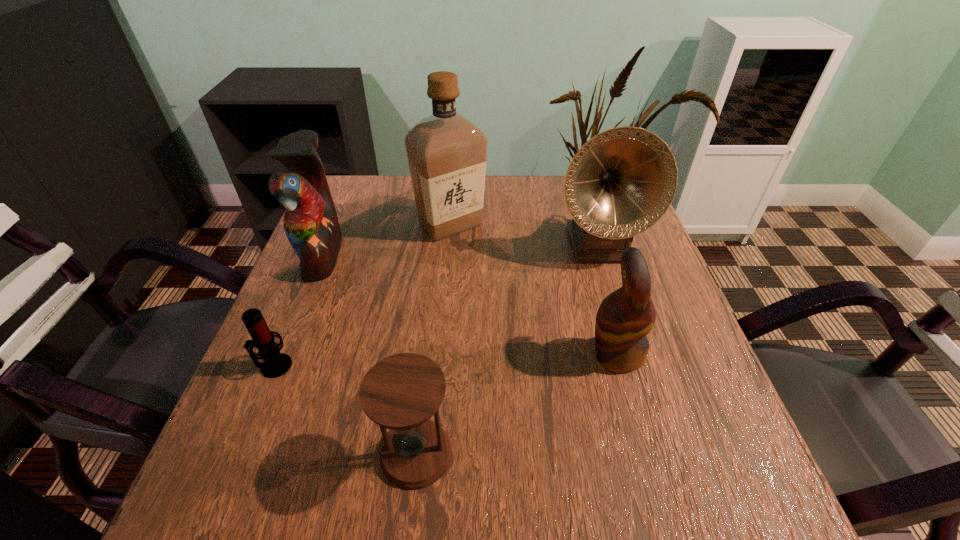
Identify the location of phonograph record located in the right edge section of the desktop. This screenshot has width=960, height=540. (622, 181).

Find the location of a particular element. parrot situated at the right edge is located at coordinates (624, 318).

At what (x,y) coordinates should I click in order to perform the action: click on object located at the far right corner. Please return your answer as a coordinate pair (x, y). Looking at the image, I should click on (622, 181).

What are the coordinates of `free space at the far edge of the desktop` in the screenshot? It's located at (504, 204).

The width and height of the screenshot is (960, 540). In the image, there is a desktop. What are the coordinates of `vacant space at the near edge` in the screenshot? It's located at (325, 513).

At what (x,y) coordinates should I click in order to perform the action: click on vacant area at the left edge. Please return your answer as a coordinate pair (x, y). This screenshot has width=960, height=540. Looking at the image, I should click on (284, 308).

This screenshot has height=540, width=960. In the image, there is a desktop. Find the location of `vacant space at the right edge`. vacant space at the right edge is located at coordinates (675, 377).

Image resolution: width=960 pixels, height=540 pixels. Find the location of `vacant region at the far left corner`. vacant region at the far left corner is located at coordinates (354, 174).

This screenshot has width=960, height=540. What are the coordinates of `vacant region at the near left corner` in the screenshot? It's located at (247, 502).

Find the location of `vacant space that is in between the fifth tallest object and the phonograph record`. vacant space that is in between the fifth tallest object and the phonograph record is located at coordinates (507, 349).